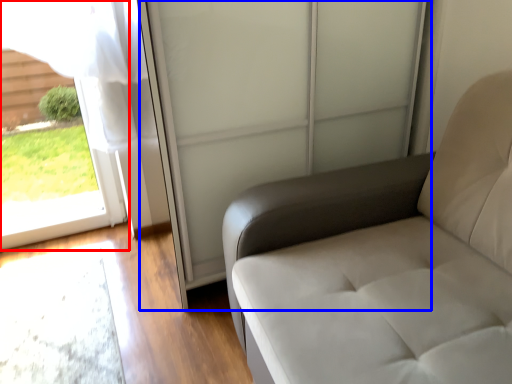
Question: Which object appears closest to the camera in this image, window (highlighted by a red box) or screen door (highlighted by a blue box)?

Choices:
 (A) window
 (B) screen door

Answer: (B)